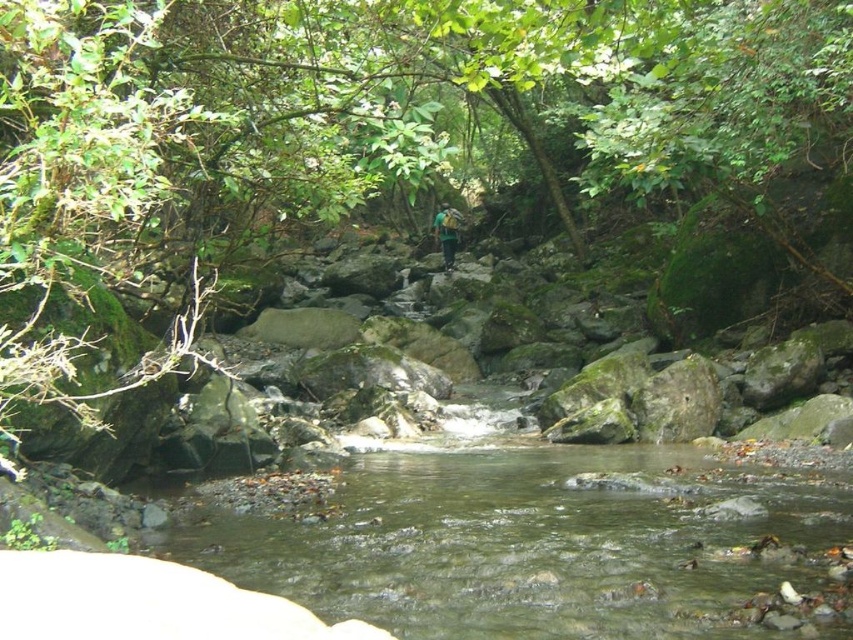
Is clear water at center below green fabric backpack at center?

Yes.

Does point (843, 541) come in front of point (440, 208)?

Yes, point (843, 541) is closer to viewer.

The width and height of the screenshot is (853, 640). What are the coordinates of `clear water at center` in the screenshot? It's located at (538, 545).